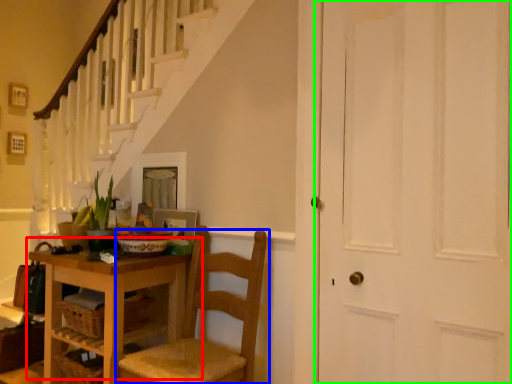
Question: Considering the real-world distances, which object is farthest from table (highlighted by a red box)? chair (highlighted by a blue box) or door (highlighted by a green box)?

Choices:
 (A) chair
 (B) door

Answer: (B)